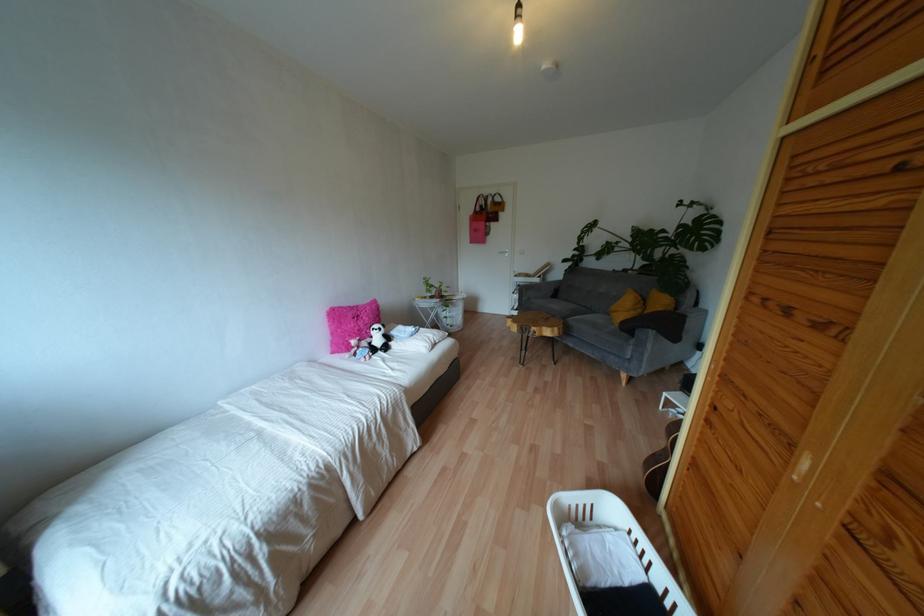
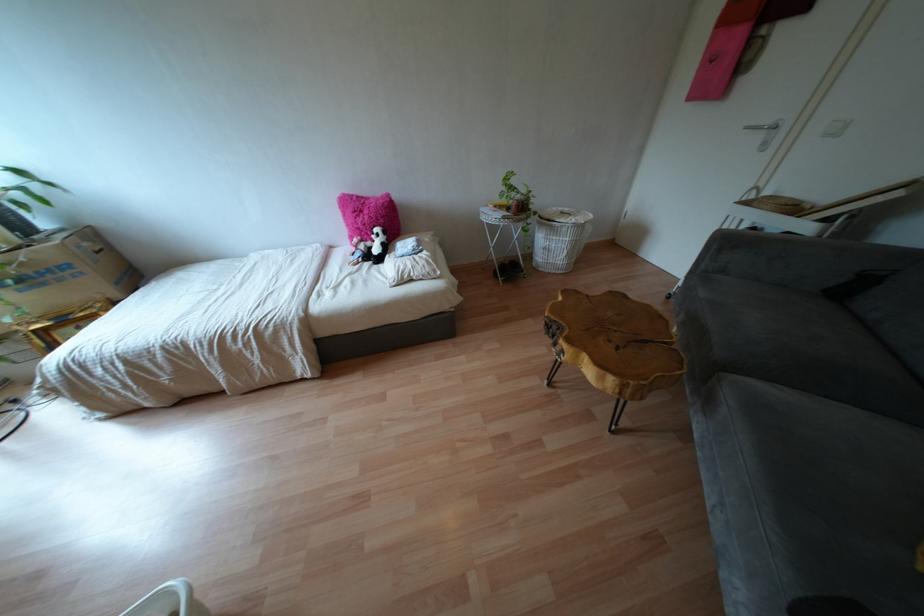
Where in the second image is the point corresponding to pixel 520 290 from the first image?

(723, 243)